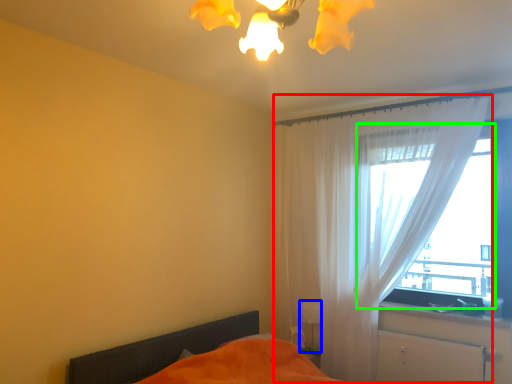
Question: Estimate the real-world distances between objects in this image. Which object is closer to curtain (highlighted by a red box), table lamp (highlighted by a blue box) or window (highlighted by a green box)?

Choices:
 (A) table lamp
 (B) window

Answer: (B)